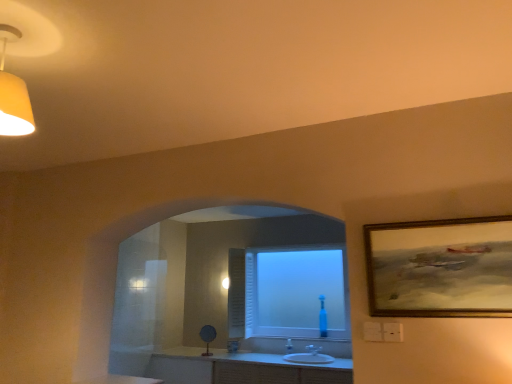
Question: From a real-world perspective, is gold-framed painting at upper right below white glossy sink at center?

Choices:
 (A) no
 (B) yes

Answer: (A)

Question: Considering the relative sizes of gold-framed painting at upper right and white glossy sink at center in the image provided, is gold-framed painting at upper right bigger than white glossy sink at center?

Choices:
 (A) yes
 (B) no

Answer: (B)

Question: From a real-world perspective, is gold-framed painting at upper right physically above white glossy sink at center?

Choices:
 (A) yes
 (B) no

Answer: (A)

Question: Is gold-framed painting at upper right placed right next to white glossy sink at center?

Choices:
 (A) no
 (B) yes

Answer: (A)

Question: Does gold-framed painting at upper right lie behind white glossy sink at center?

Choices:
 (A) yes
 (B) no

Answer: (B)

Question: Does gold-framed painting at upper right contain white glossy sink at center?

Choices:
 (A) yes
 (B) no

Answer: (B)

Question: Is white glossy counter top at lower center shorter than white glossy sink at center?

Choices:
 (A) no
 (B) yes

Answer: (B)

Question: From a real-world perspective, is white glossy counter top at lower center located beneath white glossy sink at center?

Choices:
 (A) no
 (B) yes

Answer: (A)

Question: Can you confirm if white glossy counter top at lower center is smaller than white glossy sink at center?

Choices:
 (A) no
 (B) yes

Answer: (B)

Question: Is white glossy counter top at lower center to the right of white glossy sink at center from the viewer's perspective?

Choices:
 (A) yes
 (B) no

Answer: (B)

Question: From the image's perspective, is white glossy counter top at lower center over white glossy sink at center?

Choices:
 (A) no
 (B) yes

Answer: (B)

Question: Is white glossy counter top at lower center located outside white glossy sink at center?

Choices:
 (A) no
 (B) yes

Answer: (B)

Question: From the image's perspective, would you say white glossy counter top at lower center is positioned over frosted glass window at center?

Choices:
 (A) yes
 (B) no

Answer: (B)